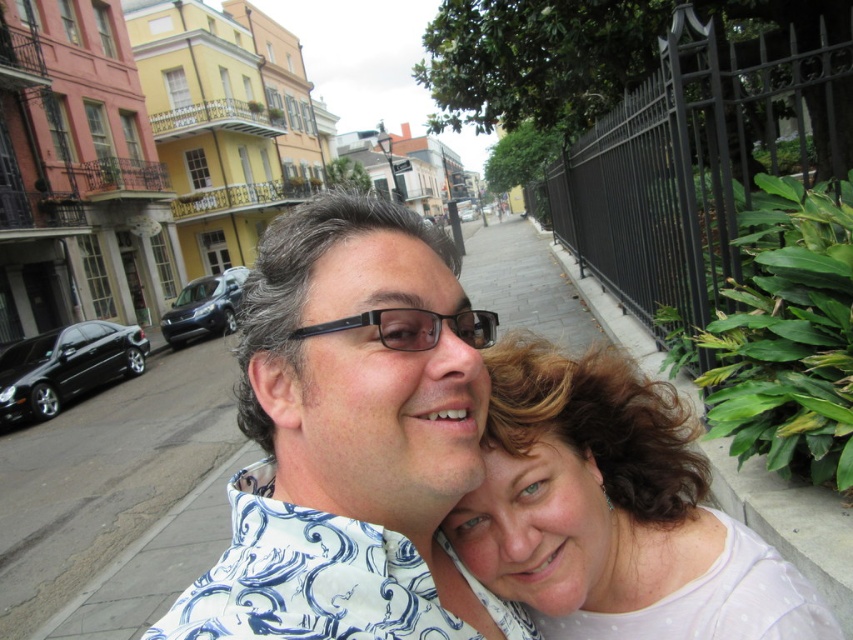
Who is more distant from viewer, (643, 394) or (384, 339)?

Positioned behind is point (643, 394).

In order to click on white dotted shirt at center in this screenshot , I will do `click(613, 513)`.

This screenshot has width=853, height=640. I want to click on white dotted shirt at center, so click(613, 513).

Who is more distant from viewer, (456, 284) or (578, 637)?

Positioned behind is point (578, 637).

Does white printed shirt at center appear over white dotted shirt at center?

Indeed, white printed shirt at center is positioned over white dotted shirt at center.

I want to click on white printed shirt at center, so click(x=351, y=438).

Which of these two, white printed shirt at center or black plastic glasses at center, stands shorter?

black plastic glasses at center is shorter.

Is white printed shirt at center bigger than black plastic glasses at center?

Yes.

Where is `white printed shirt at center`? This screenshot has height=640, width=853. white printed shirt at center is located at coordinates (351, 438).